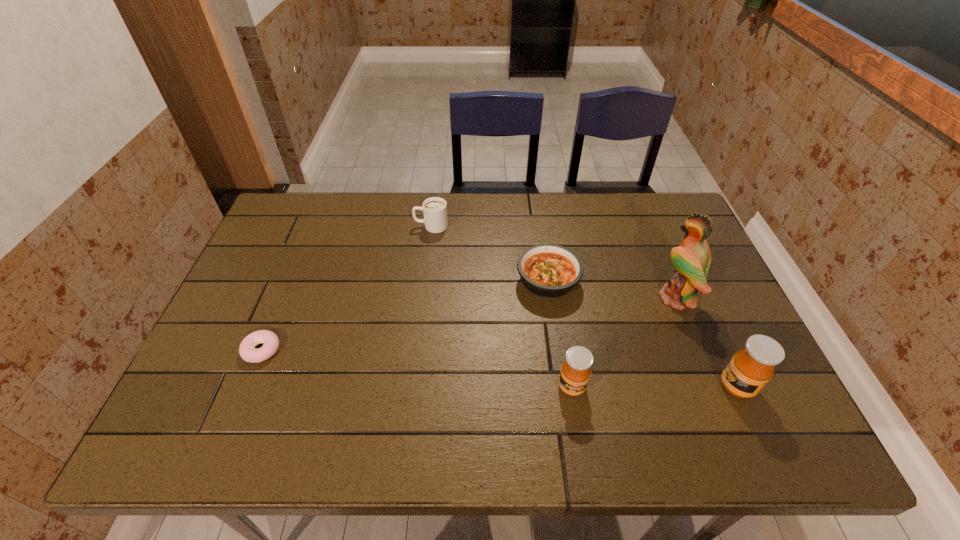
The height and width of the screenshot is (540, 960). In order to click on vacant space located on the left of the stew in this screenshot , I will do `click(403, 281)`.

Identify the location of object situated at the far edge. The height and width of the screenshot is (540, 960). (434, 209).

You are a GUI agent. You are given a task and a screenshot of the screen. Output one action in this format:
    pyautogui.click(x=<x>, y=<y>)
    Task: Click on the object that is at the left edge
    The image size is (960, 540).
    Given the screenshot: What is the action you would take?
    pyautogui.click(x=247, y=351)

What are the coordinates of `honey that is at the right edge` in the screenshot? It's located at (750, 369).

Locate an element on the screen. The height and width of the screenshot is (540, 960). parrot positioned at the right edge is located at coordinates (692, 259).

Find the location of `object that is at the near right corner`. object that is at the near right corner is located at coordinates (750, 369).

In the image, there is a desktop. Where is `vacant space at the far edge`? The width and height of the screenshot is (960, 540). vacant space at the far edge is located at coordinates click(614, 205).

Image resolution: width=960 pixels, height=540 pixels. What are the coordinates of `vacant region at the near edge of the desktop` in the screenshot? It's located at (427, 378).

Identify the location of free space at the right edge of the desktop. The width and height of the screenshot is (960, 540). tap(660, 269).

What are the coordinates of `vacant space at the far left corner` in the screenshot? It's located at (317, 232).